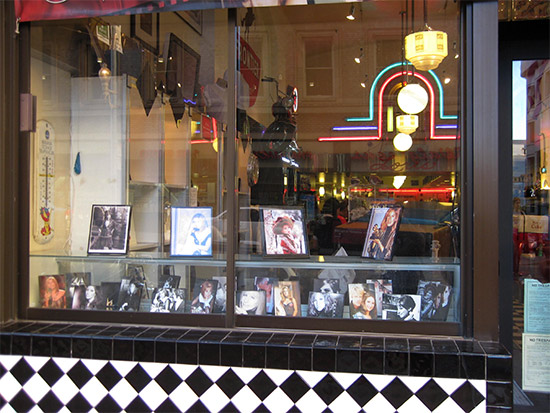
This screenshot has height=413, width=550. Find the location of `pink neon light`. pink neon light is located at coordinates (380, 124).